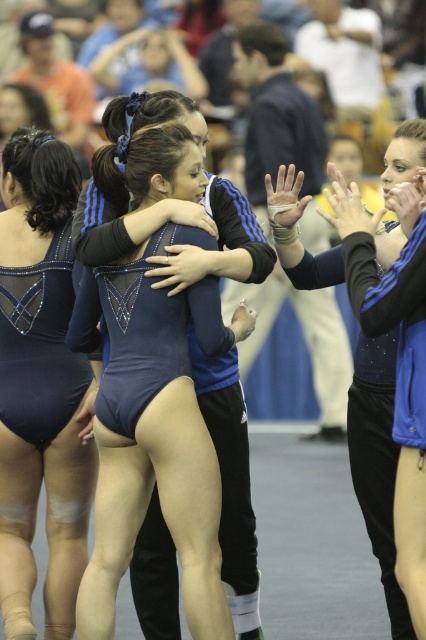
Question: Where is shiny blue leotard at center located in relation to matte blue leotard at center in the image?

Choices:
 (A) above
 (B) below

Answer: (B)

Question: Does shiny blue leotard at center have a greater width compared to matte blue leotard at center?

Choices:
 (A) no
 (B) yes

Answer: (B)

Question: Which point appears closest to the camera in this image?

Choices:
 (A) (127, 332)
 (B) (55, 381)

Answer: (A)

Question: Among these points, which one is nearest to the camera?

Choices:
 (A) [x=20, y=355]
 (B) [x=112, y=336]

Answer: (B)

Question: Is shiny blue leotard at center further to the viewer compared to matte blue leotard at center?

Choices:
 (A) no
 (B) yes

Answer: (A)